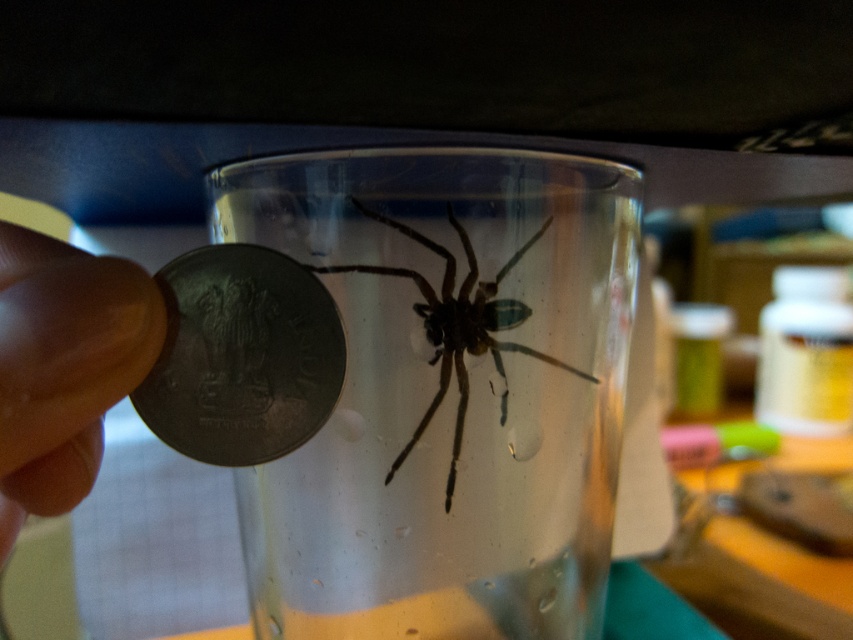
You are a scientist measuring the distance between two coins next to a spider in a cup. The coins are the matte metallic coin at left and the metallic gray coin at lower left. According to your measurements, how far apart are these two coins?

The matte metallic coin at left and the metallic gray coin at lower left are 0.77 inches apart.

You are a photographer trying to capture a detailed image of the transparent glass at center. Your camera has a minimum focusing distance of 25 centimeters. Can you take a clear photo without moving the glass?

The distance between the transparent glass at center and the camera is 22.35 centimeters, which is less than the camera minimum focusing distance of 25 centimeters. Therefore, you cannot take a clear photo without moving the glass closer.